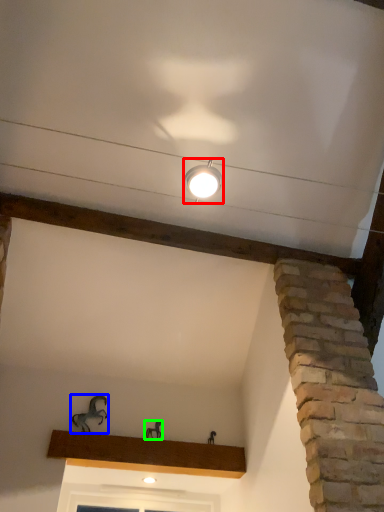
Question: Based on their relative distances, which object is farther from lamp (highlighted by a red box)? Choose from animal (highlighted by a blue box) and animal (highlighted by a green box).

Choices:
 (A) animal
 (B) animal

Answer: (B)